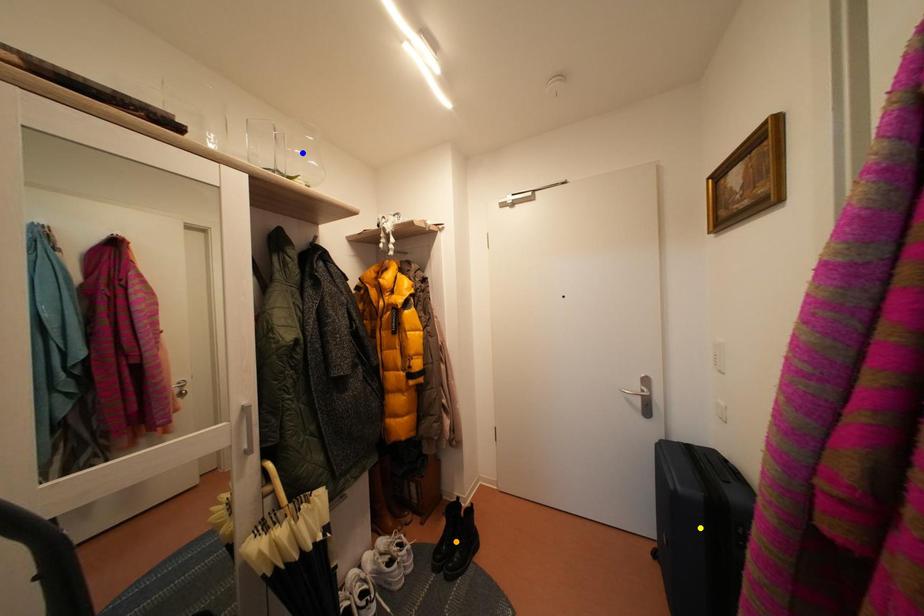
Order these from nearest to farthest:
blue point, yellow point, orange point

1. yellow point
2. blue point
3. orange point